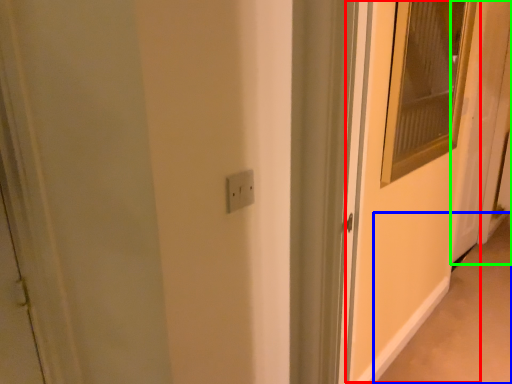
Question: Which is farther away from screen door (highlighted by a red box)? alley (highlighted by a blue box) or door (highlighted by a green box)?

Choices:
 (A) alley
 (B) door

Answer: (B)